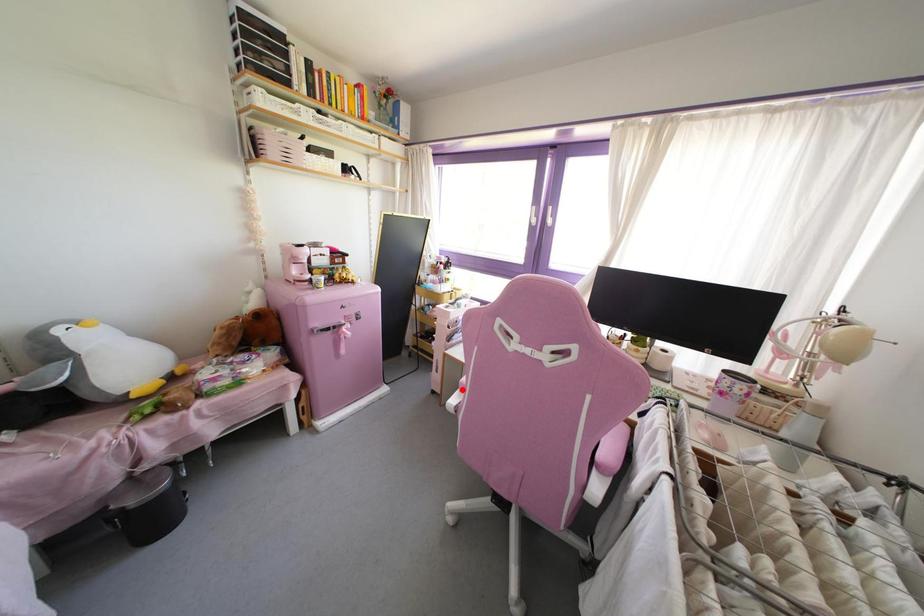
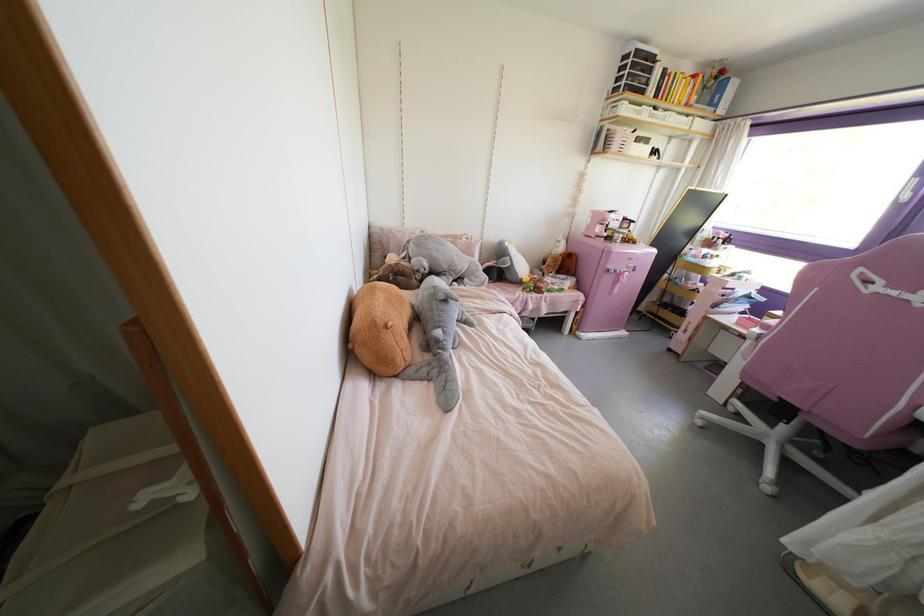
Find the pixel in the second image that matches the highlighted location in the first image.

(764, 326)